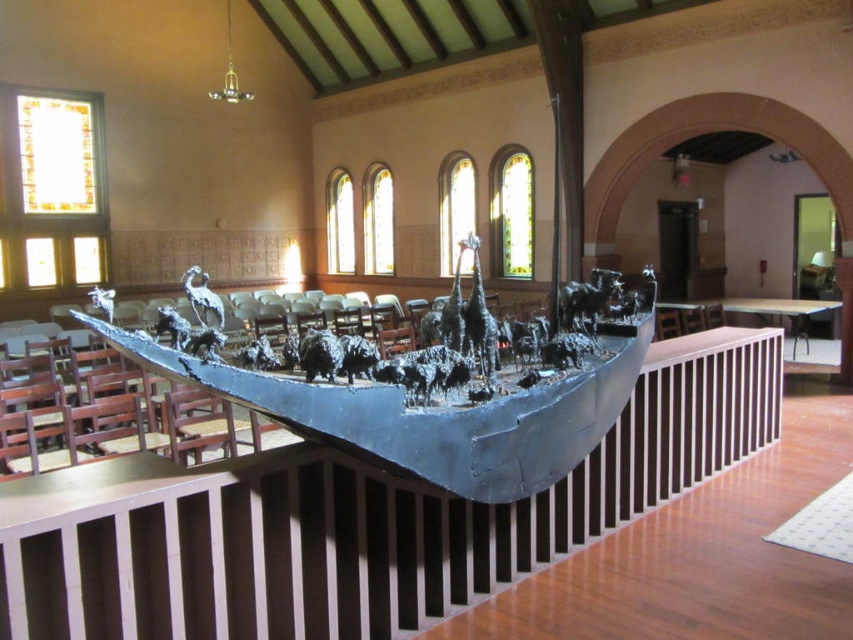
Consider the image. Is shiny metallic boat at center positioned in front of shiny silver crane at center?

Yes, shiny metallic boat at center is in front of shiny silver crane at center.

Which is below, shiny metallic boat at center or shiny silver crane at center?

shiny metallic boat at center is lower down.

You are a GUI agent. You are given a task and a screenshot of the screen. Output one action in this format:
    pyautogui.click(x=<x>, y=<y>)
    Task: Click on the shiny metallic boat at center
    Image resolution: width=853 pixels, height=640 pixels.
    Given the screenshot: What is the action you would take?
    pyautogui.click(x=432, y=416)